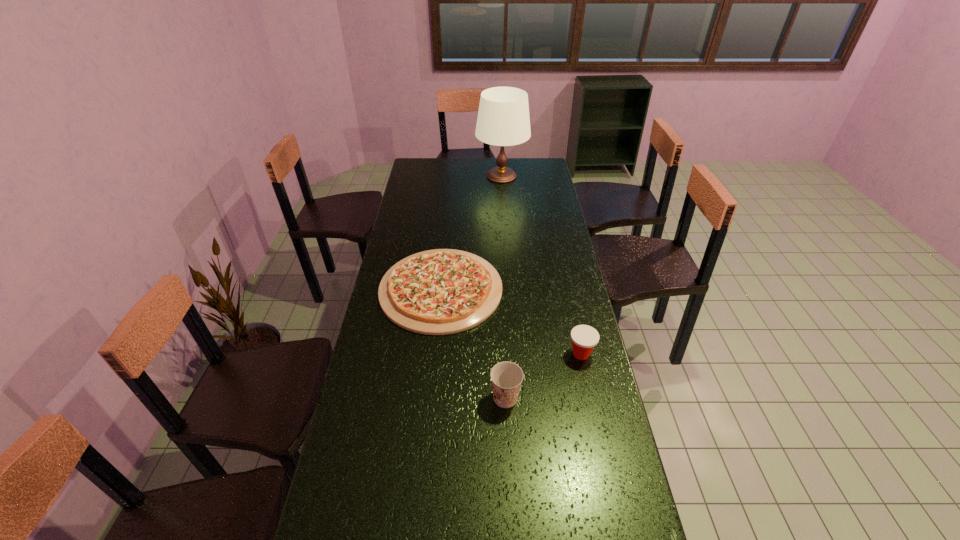
In order to click on object that stands as the third closest to the third tallest object in this screenshot , I will do `click(503, 119)`.

This screenshot has width=960, height=540. I want to click on object identified as the second closest to the taller Dixie cup, so click(443, 291).

Identify the location of blank space that satisfies the following two spatial constraints: 1. on the front side of the shorter Dixie cup; 2. on the left side of the tallest object. (515, 354).

I want to click on vacant region that satisfies the following two spatial constraints: 1. on the back side of the third tallest object; 2. on the left side of the taller Dixie cup, so click(x=503, y=354).